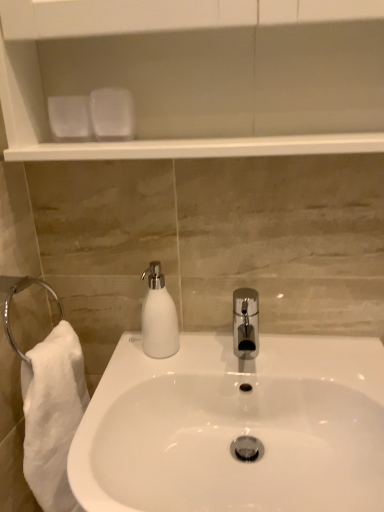
Question: Considering the relative sizes of white glossy sink at center and white matte soap dispenser at center in the image provided, is white glossy sink at center bigger than white matte soap dispenser at center?

Choices:
 (A) yes
 (B) no

Answer: (A)

Question: From the image's perspective, is white glossy sink at center located beneath white matte soap dispenser at center?

Choices:
 (A) no
 (B) yes

Answer: (B)

Question: Does white glossy sink at center have a greater height compared to white matte soap dispenser at center?

Choices:
 (A) yes
 (B) no

Answer: (A)

Question: Is white glossy sink at center shorter than white matte soap dispenser at center?

Choices:
 (A) no
 (B) yes

Answer: (A)

Question: Is white glossy sink at center wider than white matte soap dispenser at center?

Choices:
 (A) no
 (B) yes

Answer: (B)

Question: Is white glossy sink at center turned away from white matte soap dispenser at center?

Choices:
 (A) no
 (B) yes

Answer: (A)

Question: Can you confirm if white matte soap dispenser at center is thinner than white glossy sink at center?

Choices:
 (A) yes
 (B) no

Answer: (A)

Question: Is white matte soap dispenser at center in contact with white glossy sink at center?

Choices:
 (A) no
 (B) yes

Answer: (A)

Question: Considering the relative sizes of white matte soap dispenser at center and white glossy sink at center in the image provided, is white matte soap dispenser at center smaller than white glossy sink at center?

Choices:
 (A) yes
 (B) no

Answer: (A)

Question: Considering the relative positions of white matte soap dispenser at center and white glossy sink at center in the image provided, is white matte soap dispenser at center in front of white glossy sink at center?

Choices:
 (A) yes
 (B) no

Answer: (B)

Question: Is white matte soap dispenser at center further to camera compared to white glossy sink at center?

Choices:
 (A) no
 (B) yes

Answer: (B)

Question: Is white matte soap dispenser at center facing towards white glossy sink at center?

Choices:
 (A) yes
 (B) no

Answer: (B)

Question: From the image's perspective, relative to white glossy sink at center, is white matte soap dispenser at center above or below?

Choices:
 (A) above
 (B) below

Answer: (A)